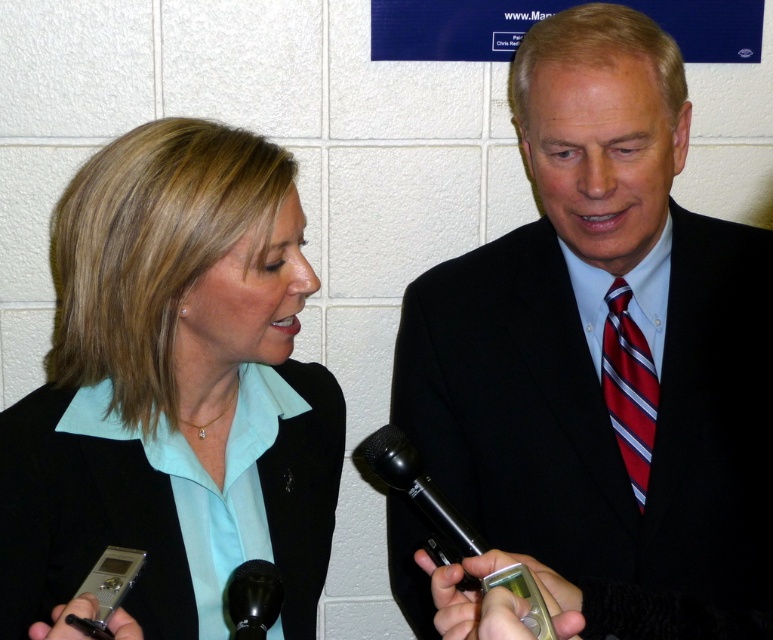
Question: Considering the relative positions of matte black suit at center and black plastic microphone at center in the image provided, where is matte black suit at center located with respect to black plastic microphone at center?

Choices:
 (A) above
 (B) below

Answer: (A)

Question: Does matte black suit at center appear on the left side of black plastic microphone at center?

Choices:
 (A) yes
 (B) no

Answer: (B)

Question: Does matte black blazer at left have a larger size compared to red striped tie at right?

Choices:
 (A) yes
 (B) no

Answer: (A)

Question: Which point appears farthest from the camera in this image?

Choices:
 (A) (172, 248)
 (B) (369, 456)
 (C) (771, 417)
 (D) (278, 612)

Answer: (C)

Question: Which of these objects is positioned farthest from the black matte microphone at lower center?

Choices:
 (A) black plastic microphone at center
 (B) matte black blazer at left

Answer: (B)

Question: Which point is farther to the camera?

Choices:
 (A) red striped tie at right
 (B) black matte microphone at lower center

Answer: (A)